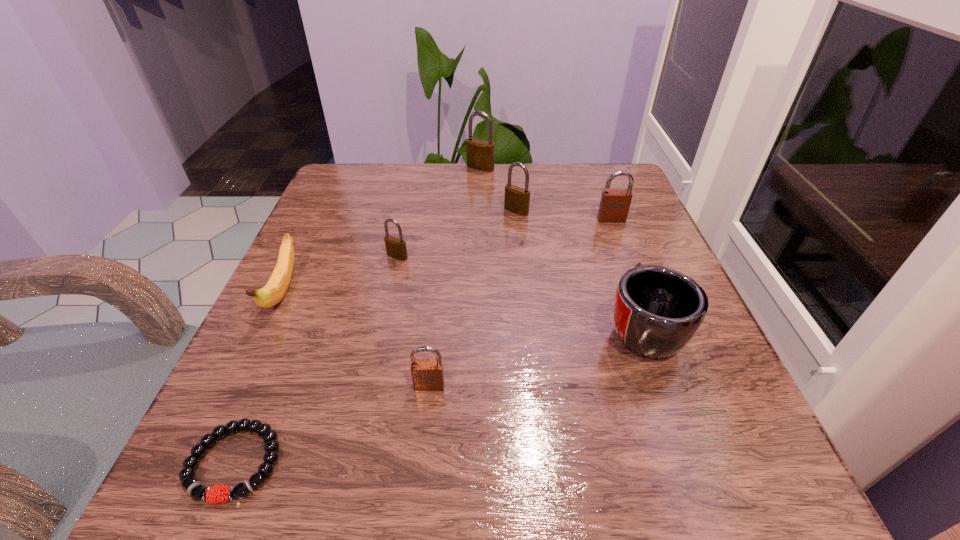
Where is `the left brown padlock`? This screenshot has height=540, width=960. the left brown padlock is located at coordinates (427, 374).

Identify the location of banana. The width and height of the screenshot is (960, 540). (273, 292).

Where is `bracelet`? bracelet is located at coordinates (218, 494).

This screenshot has width=960, height=540. Identify the location of black bracelet. (218, 494).

Find the location of a particular element. The height and width of the screenshot is (540, 960). vacant space located on the left of the second brass padlock from right to left is located at coordinates (337, 167).

Locate an element on the screen. Image resolution: width=960 pixels, height=540 pixels. free spot located on the back of the second biggest brass padlock is located at coordinates (515, 192).

The image size is (960, 540). In order to click on vacant area located on the front-facing side of the rightmost padlock in this screenshot , I will do `click(660, 343)`.

The width and height of the screenshot is (960, 540). I want to click on vacant position located on the side of the mug with the handle, so click(x=619, y=263).

Locate an element on the screen. free point located on the side of the mug with the handle is located at coordinates (603, 219).

I want to click on vacant area located 0.340m on the side of the mug with the handle, so click(594, 193).